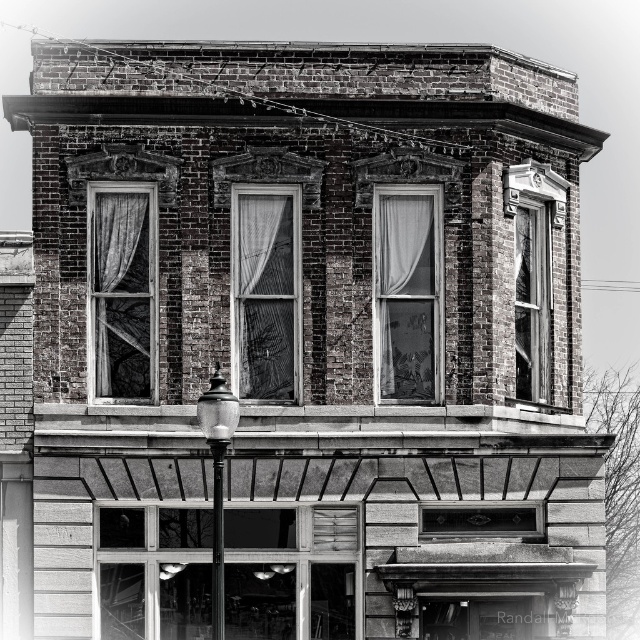
Consider the image. Which is more to the right, translucent glass window at center or translucent fabric window at center?

From the viewer's perspective, translucent fabric window at center appears more on the right side.

Locate an element on the screen. The height and width of the screenshot is (640, 640). translucent glass window at center is located at coordinates (266, 292).

Does translucent fabric curtain at left have a smaller size compared to transparent glass window at upper right?

Correct, translucent fabric curtain at left occupies less space than transparent glass window at upper right.

Is point (148, 241) positioned after point (538, 209)?

No, (148, 241) is closer to viewer.

I want to click on translucent fabric curtain at left, so click(x=124, y=292).

Is translucent fabric curtain at left positioned before black glass lamp post at center?

That is False.

Does translucent fabric curtain at left have a lesser width compared to black glass lamp post at center?

No.

The image size is (640, 640). What do you see at coordinates (124, 292) in the screenshot? I see `translucent fabric curtain at left` at bounding box center [124, 292].

Locate an element on the screen. This screenshot has width=640, height=640. translucent fabric curtain at left is located at coordinates coord(124,292).